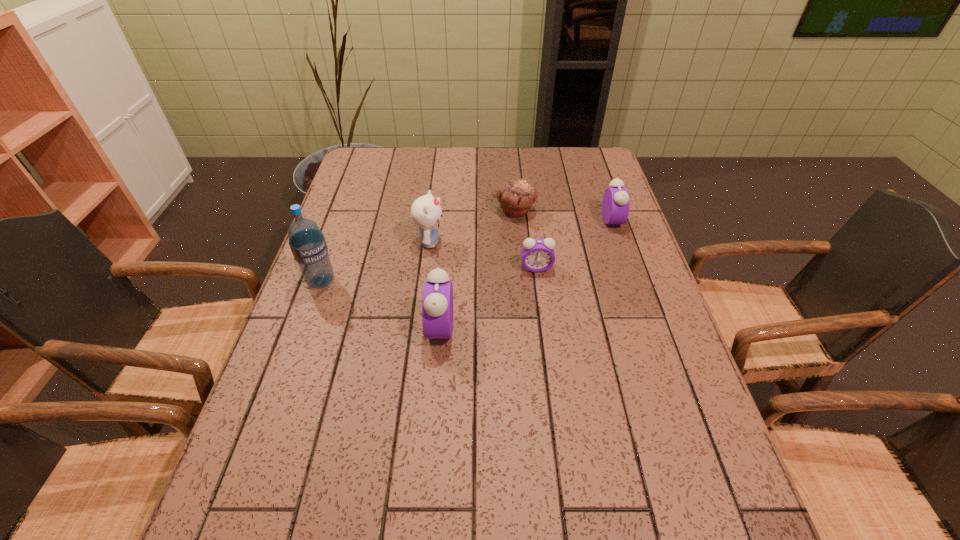
Locate an element on the screen. This screenshot has width=960, height=540. vacant space at the near edge is located at coordinates (383, 450).

The image size is (960, 540). What are the coordinates of `blank area at the left edge` in the screenshot? It's located at (354, 275).

In order to click on free space at the right edge in this screenshot , I will do `click(615, 332)`.

At what (x,y) coordinates should I click in order to perform the action: click on free location at the far left corner of the desktop. Please return your answer as a coordinate pair (x, y). The height and width of the screenshot is (540, 960). Looking at the image, I should click on (358, 163).

This screenshot has height=540, width=960. In order to click on vacant area that lies between the second tallest alarm clock and the muffin in this screenshot , I will do `click(564, 215)`.

Where is `vacant space that is in between the farthest alarm clock and the water bottle`? vacant space that is in between the farthest alarm clock and the water bottle is located at coordinates (467, 251).

Image resolution: width=960 pixels, height=540 pixels. Identify the location of free spot between the farthest alarm clock and the second nearest alarm clock. (574, 244).

The height and width of the screenshot is (540, 960). In order to click on free spot between the muffin and the water bottle in this screenshot , I will do `click(419, 246)`.

The height and width of the screenshot is (540, 960). I want to click on free space between the nearest object and the tallest object, so click(381, 305).

I want to click on vacant point located between the muffin and the rightmost object, so click(564, 215).